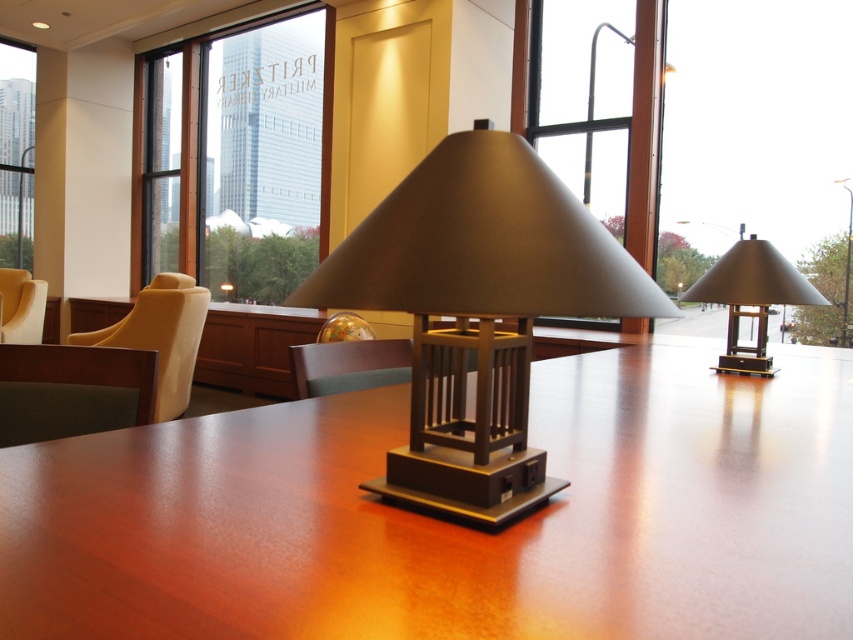
Can you confirm if transparent glass window at upper left is positioned above yellow fabric armchair at left?

Yes, transparent glass window at upper left is above yellow fabric armchair at left.

Does transparent glass window at upper left appear on the right side of yellow fabric armchair at left?

Yes, transparent glass window at upper left is to the right of yellow fabric armchair at left.

Find the location of a particular element. This screenshot has height=640, width=853. transparent glass window at upper left is located at coordinates (235, 138).

In the scene shown: Between transparent glass window at upper left and soft beige fabric armchair at left, which one is positioned lower?

soft beige fabric armchair at left is below.

This screenshot has height=640, width=853. I want to click on transparent glass window at upper left, so click(235, 138).

Can you confirm if transparent glass window at upper left is thinner than beige leather chair at left?

No, transparent glass window at upper left is not thinner than beige leather chair at left.

Can you confirm if transparent glass window at upper left is taller than beige leather chair at left?

Yes, transparent glass window at upper left is taller than beige leather chair at left.

Which is behind, point (321, 131) or point (19, 280)?

The point (321, 131) is more distant.

The image size is (853, 640). In order to click on transparent glass window at upper left in this screenshot , I will do `click(235, 138)`.